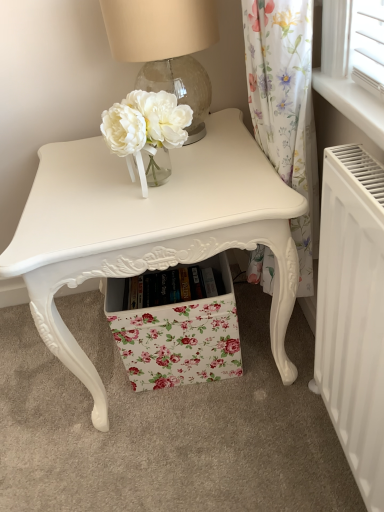
This screenshot has height=512, width=384. I want to click on vacant space situated on the left part of floral fabric drawer at center, so click(77, 378).